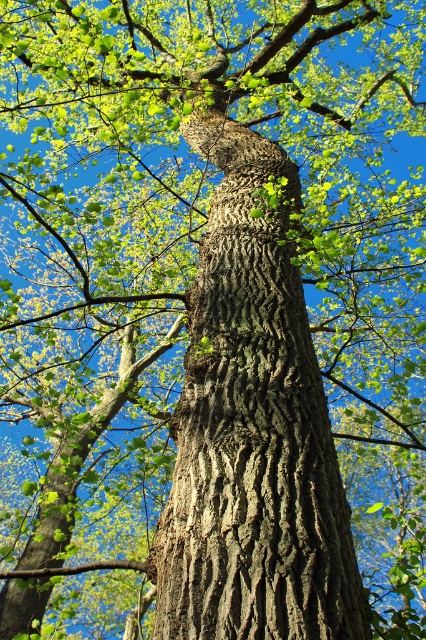
Can you confirm if dark brown textured bark at center is shorter than green matte branch at lower left?

Incorrect, dark brown textured bark at center's height does not fall short of green matte branch at lower left's.

Measure the distance between point (273, 593) and camera.

5.95 feet

You are a GUI agent. You are given a task and a screenshot of the screen. Output one action in this format:
    pyautogui.click(x=<x>, y=<y>)
    Task: Click on the dark brown textured bark at center
    Image resolution: width=426 pixels, height=640 pixels.
    Given the screenshot: What is the action you would take?
    pyautogui.click(x=252, y=429)